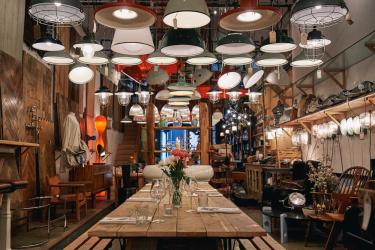
The image size is (375, 250). I want to click on chairs, so click(337, 218), click(77, 198).